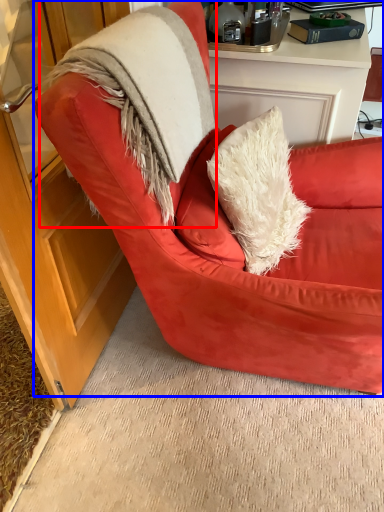
Question: Which object is further to the camera taking this photo, fur coat (highlighted by a red box) or chair (highlighted by a blue box)?

Choices:
 (A) fur coat
 (B) chair

Answer: (A)